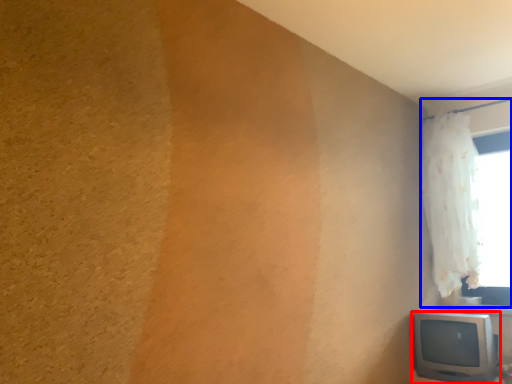
Question: Which object is closer to the camera taking this photo, television (highlighted by a red box) or window (highlighted by a blue box)?

Choices:
 (A) television
 (B) window

Answer: (A)